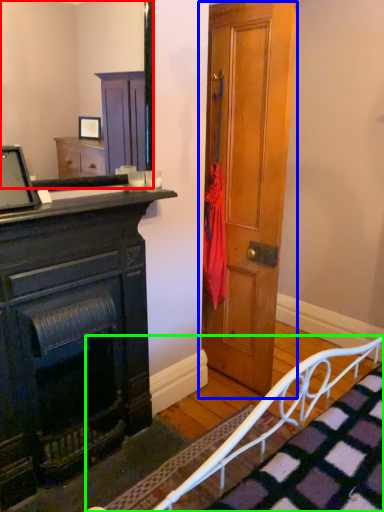
Question: Considering the real-world distances, which object is closest to mirror (highlighted by a red box)? door (highlighted by a blue box) or bed frame (highlighted by a green box).

Choices:
 (A) door
 (B) bed frame

Answer: (A)